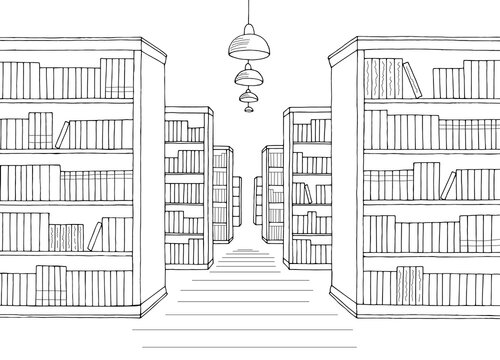
Locate an element on the screen. side of bookcase on rightmost side is located at coordinates (345, 199), (285, 203), (263, 204), (253, 203).